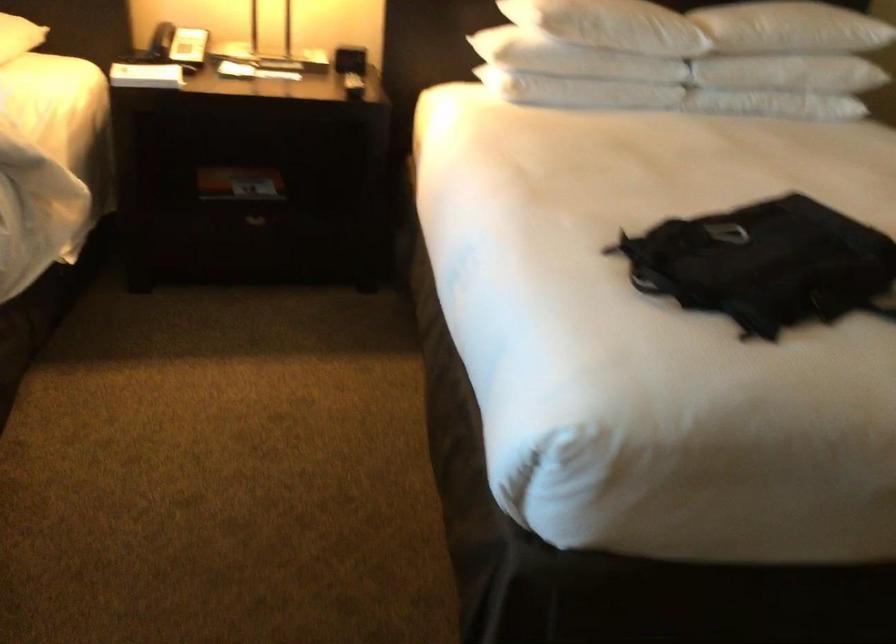
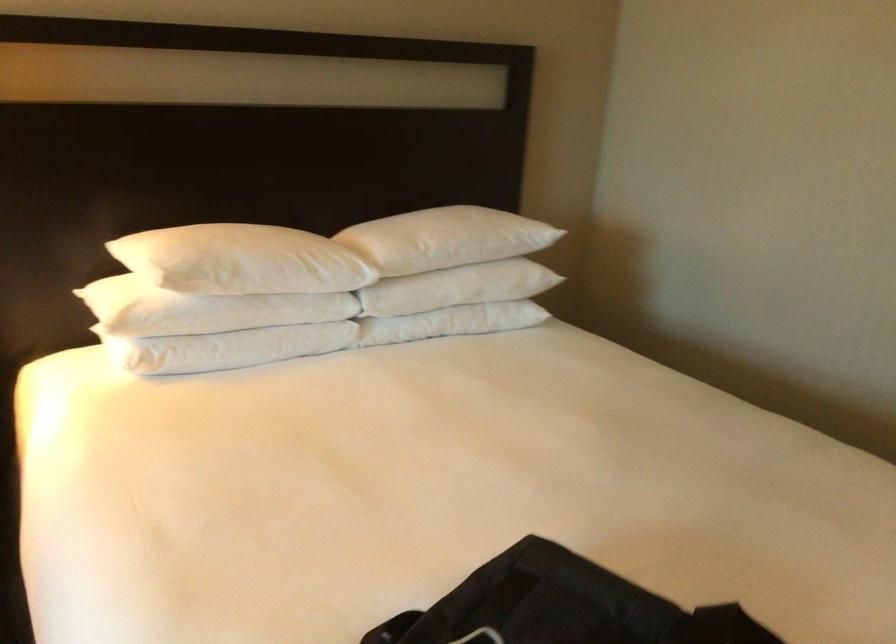
Find the pixel in the second image that matches point 770,95 in the first image.

(451, 322)